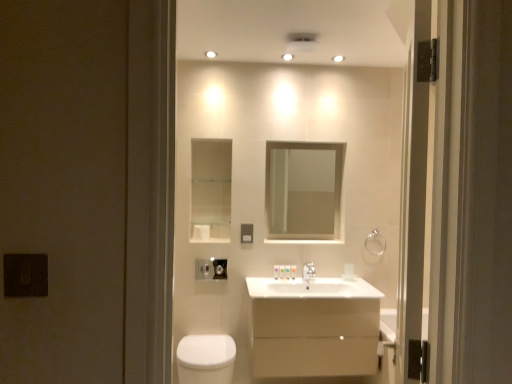
Where is `vacant area that is situated to the right of white glossy toiletries at center, the second toiletry viewed from the left`? This screenshot has width=512, height=384. vacant area that is situated to the right of white glossy toiletries at center, the second toiletry viewed from the left is located at coordinates (306, 279).